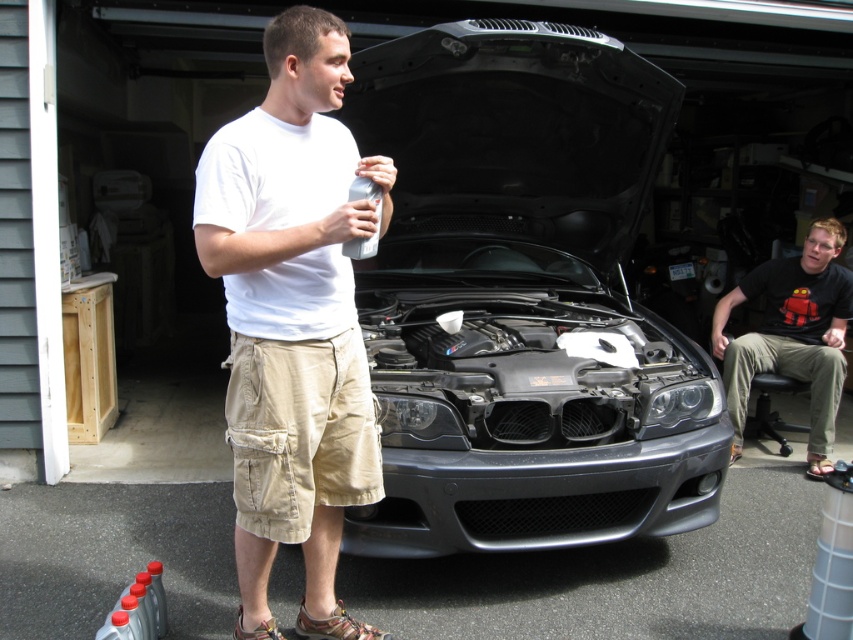
You are a mechanic observing the scene. You need to access the engine compartment of the satin black car at center. Is the black cotton shirt at right blocking your path to the engine compartment?

The satin black car at center is above the black cotton shirt at right, meaning the shirt is positioned lower or behind the car. Since the car is in front, the shirt is not blocking the path to the engine compartment.